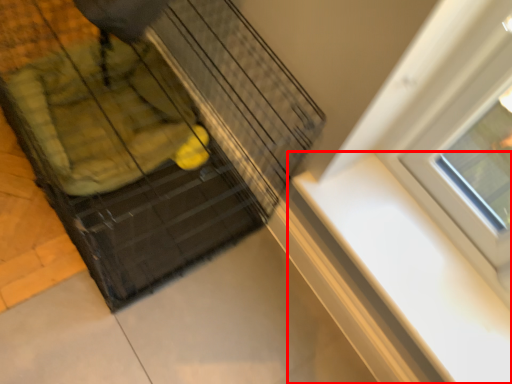
Question: From the image's perspective, what is the correct spatial positioning of window sill (annotated by the red box) in reference to baby carriage?

Choices:
 (A) above
 (B) below

Answer: (B)